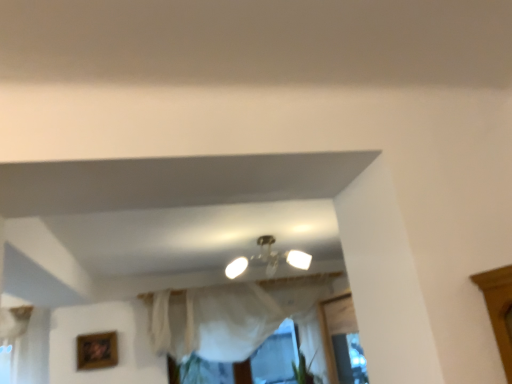
Question: Is the position of white sheer curtain at center more distant than that of green leafy plant at lower center?

Choices:
 (A) no
 (B) yes

Answer: (A)

Question: Is white sheer curtain at center positioned before green leafy plant at lower center?

Choices:
 (A) no
 (B) yes

Answer: (B)

Question: Is green leafy plant at lower center completely or partially inside white sheer curtain at center?

Choices:
 (A) no
 (B) yes

Answer: (A)

Question: Considering the relative sizes of white sheer curtain at center and green leafy plant at lower center in the image provided, is white sheer curtain at center thinner than green leafy plant at lower center?

Choices:
 (A) no
 (B) yes

Answer: (B)

Question: Can you confirm if white sheer curtain at center is smaller than green leafy plant at lower center?

Choices:
 (A) yes
 (B) no

Answer: (B)

Question: Is there a large distance between white sheer curtain at center and green leafy plant at lower center?

Choices:
 (A) no
 (B) yes

Answer: (A)

Question: From the image's perspective, is matte white ceiling light at center on top of white sheer curtain at center?

Choices:
 (A) yes
 (B) no

Answer: (A)

Question: From the image's perspective, would you say matte white ceiling light at center is shown under white sheer curtain at center?

Choices:
 (A) no
 (B) yes

Answer: (A)

Question: Considering the relative sizes of matte white ceiling light at center and white sheer curtain at center in the image provided, is matte white ceiling light at center wider than white sheer curtain at center?

Choices:
 (A) no
 (B) yes

Answer: (B)

Question: Considering the relative sizes of matte white ceiling light at center and white sheer curtain at center in the image provided, is matte white ceiling light at center shorter than white sheer curtain at center?

Choices:
 (A) no
 (B) yes

Answer: (B)

Question: Is matte white ceiling light at center oriented towards white sheer curtain at center?

Choices:
 (A) yes
 (B) no

Answer: (B)

Question: Are matte white ceiling light at center and white sheer curtain at center far apart?

Choices:
 (A) no
 (B) yes

Answer: (A)

Question: Is wooden picture frame at lower left oriented away from green leafy plant at lower center?

Choices:
 (A) yes
 (B) no

Answer: (B)